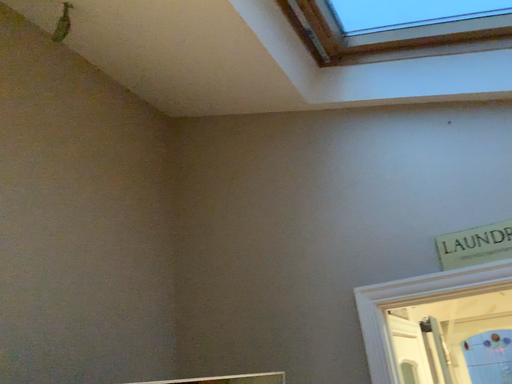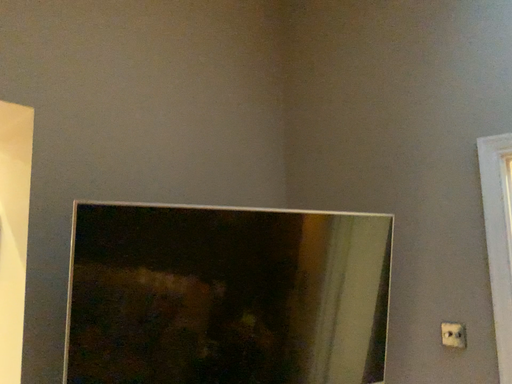
Question: How did the camera likely rotate when shooting the video?

Choices:
 (A) rotated downward
 (B) rotated upward

Answer: (A)